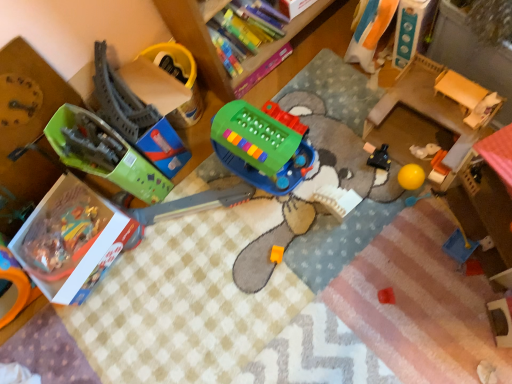
Consider the image. How much space does orange fabric doll at upper right, arranged as the third toy when viewed from the right, occupy horizontally?

6.05 inches.

Locate an element on the screen. green cardboard box at left is located at coordinates (27, 131).

Describe the element at coordinates (380, 158) in the screenshot. The image size is (512, 384). I see `black plastic toy at center-right, the second toy when ordered from right to left` at that location.

The image size is (512, 384). What are the coordinates of `gray plastic train tracks at left, marked as the 1th toy in a left-to-right arrangement` in the screenshot? It's located at (104, 153).

Considering the sizes of black plastic toy at center-right, the second toy when ordered from right to left, and orange fabric doll at upper right, arranged as the third toy when viewed from the right, in the image, is black plastic toy at center-right, the second toy when ordered from right to left, bigger or smaller than orange fabric doll at upper right, arranged as the third toy when viewed from the right,?

black plastic toy at center-right, the second toy when ordered from right to left, is smaller than orange fabric doll at upper right, arranged as the third toy when viewed from the right.

Considering their positions, is black plastic toy at center-right, which is the 5th toy in left-to-right order, located in front of or behind orange fabric doll at upper right, arranged as the third toy when viewed from the right?

Visually, black plastic toy at center-right, which is the 5th toy in left-to-right order, is located behind orange fabric doll at upper right, arranged as the third toy when viewed from the right.

From the picture: Is orange fabric doll at upper right, the fourth toy when ordered from left to right, located within black plastic toy at center-right, the second toy when ordered from right to left?

That's incorrect, orange fabric doll at upper right, the fourth toy when ordered from left to right, is not inside black plastic toy at center-right, the second toy when ordered from right to left.

Looking at this image, is gray plastic train tracks at left, placed as the sixth toy when sorted from right to left, beside wooden changing table at right?

gray plastic train tracks at left, placed as the sixth toy when sorted from right to left, and wooden changing table at right are clearly separated.

Is gray plastic train tracks at left, marked as the 1th toy in a left-to-right arrangement, to the right of wooden changing table at right from the viewer's perspective?

No.

Can you confirm if gray plastic train tracks at left, marked as the 1th toy in a left-to-right arrangement, is thinner than wooden changing table at right?

In fact, gray plastic train tracks at left, marked as the 1th toy in a left-to-right arrangement, might be wider than wooden changing table at right.

Is wooden changing table at right facing away from gray plastic train tracks at left, the 5th toy positioned from the right?

No, wooden changing table at right is not facing away from gray plastic train tracks at left, the 5th toy positioned from the right.

Which object is positioned more to the right, wooden changing table at right or gray plastic train tracks at left, the 2th toy in the left-to-right sequence?

Positioned to the right is wooden changing table at right.

Considering the positions of points (407, 95) and (154, 146), is point (407, 95) farther from camera compared to point (154, 146)?

No, it is not.

Is wooden changing table at right beside gray plastic train tracks at left, the 2th toy in the left-to-right sequence?

wooden changing table at right and gray plastic train tracks at left, the 2th toy in the left-to-right sequence, are clearly separated.

Can you confirm if matte cardboard box at upper center, which is the first box in top-to-bottom order, is shorter than hardcover book at upper center?

Yes, matte cardboard box at upper center, which is the first box in top-to-bottom order, is shorter than hardcover book at upper center.

Considering the positions of point (298, 5) and point (242, 14), is point (298, 5) closer or farther from the camera than point (242, 14)?

Point (298, 5) is farther from the camera than point (242, 14).

At what (x,y) coordinates should I click in order to perform the action: click on the 1st box below the hardcover book at upper center (from a real-world perspective). Please return your answer as a coordinate pair (x, y). Looking at the image, I should click on (294, 7).

Can you confirm if gray plastic train tracks at left, placed as the sixth toy when sorted from right to left, is bigger than green plastic toy at center, arranged as the 4th toy when viewed from the right?

Indeed, gray plastic train tracks at left, placed as the sixth toy when sorted from right to left, has a larger size compared to green plastic toy at center, arranged as the 4th toy when viewed from the right.

From the image's perspective, is gray plastic train tracks at left, marked as the 1th toy in a left-to-right arrangement, on green plastic toy at center, placed as the third toy when sorted from left to right?

No.

From a real-world perspective, is gray plastic train tracks at left, placed as the sixth toy when sorted from right to left, located higher than green plastic toy at center, placed as the third toy when sorted from left to right?

Yes.

The width and height of the screenshot is (512, 384). I want to click on toy that is the 2nd one when counting downward from the green plastic toy at center, placed as the third toy when sorted from left to right (from the image's perspective), so click(x=104, y=153).

Considering the sizes of blue plastic dustpan at lower right, which ranks as the 1th toy in right-to-left order, and hardcover book at upper center in the image, is blue plastic dustpan at lower right, which ranks as the 1th toy in right-to-left order, taller or shorter than hardcover book at upper center?

Clearly, blue plastic dustpan at lower right, which ranks as the 1th toy in right-to-left order, is shorter compared to hardcover book at upper center.

Which is correct: blue plastic dustpan at lower right, the 6th toy in the left-to-right sequence, is inside hardcover book at upper center, or outside of it?

blue plastic dustpan at lower right, the 6th toy in the left-to-right sequence, is not enclosed by hardcover book at upper center.

Are blue plastic dustpan at lower right, the 6th toy in the left-to-right sequence, and hardcover book at upper center making contact?

blue plastic dustpan at lower right, the 6th toy in the left-to-right sequence, is not next to hardcover book at upper center, and they're not touching.

From the image's perspective, relative to hardcover book at upper center, is blue plastic dustpan at lower right, which ranks as the 1th toy in right-to-left order, above or below?

From the image's perspective, blue plastic dustpan at lower right, which ranks as the 1th toy in right-to-left order, appears below hardcover book at upper center.

Is blue plastic dustpan at lower right, the 6th toy in the left-to-right sequence, directly adjacent to green cardboard box at left?

No.

Is point (462, 247) positioned after point (27, 148)?

No, (462, 247) is closer to viewer.

From the image's perspective, which object appears higher, blue plastic dustpan at lower right, the 6th toy in the left-to-right sequence, or green cardboard box at left?

green cardboard box at left is shown above in the image.

Which object is closer to the camera taking this photo, blue plastic dustpan at lower right, the 6th toy in the left-to-right sequence, or green cardboard box at left?

green cardboard box at left is in front.

Starting from the orange fabric doll at upper right, arranged as the third toy when viewed from the right, which toy is the 1st one to the right? Please provide its 2D coordinates.

[(380, 158)]

Where is `toy that is the 3rd object located below the wooden changing table at right (from the image's perspective)`? This screenshot has height=384, width=512. toy that is the 3rd object located below the wooden changing table at right (from the image's perspective) is located at coordinates point(104,153).

Considering their positions, is green plastic toy at center, placed as the third toy when sorted from left to right, positioned closer to orange fabric doll at upper right, arranged as the third toy when viewed from the right, than wooden changing table at right?

The object closer to orange fabric doll at upper right, arranged as the third toy when viewed from the right, is wooden changing table at right.

Based on their spatial positions, is white cardboard box at left, marked as the second box in a right-to-left arrangement, or black plastic toy at center-right, which is the 5th toy in left-to-right order, further from gray plastic train tracks at left, the 2th toy in the left-to-right sequence?

black plastic toy at center-right, which is the 5th toy in left-to-right order, is further to gray plastic train tracks at left, the 2th toy in the left-to-right sequence.

From the image, which object appears to be farther from wooden bookshelf at upper center, gray plastic train tracks at left, the 5th toy positioned from the right, or orange fabric doll at upper right, arranged as the third toy when viewed from the right?

orange fabric doll at upper right, arranged as the third toy when viewed from the right, is further to wooden bookshelf at upper center.

Looking at the image, which one is located further to matte cardboard box at upper center, which is counted as the second box, starting from the bottom, wooden changing table at right or green cardboard box at left?

green cardboard box at left.

Based on their spatial positions, is wooden changing table at right or green plastic toy at center, placed as the third toy when sorted from left to right, closer to hardcover book at upper center?

Among the two, green plastic toy at center, placed as the third toy when sorted from left to right, is located nearer to hardcover book at upper center.

Which object lies nearer to the anchor point orange fabric doll at upper right, the fourth toy when ordered from left to right, gray plastic train tracks at left, marked as the 1th toy in a left-to-right arrangement, or matte cardboard box at upper center, which is counted as the second box, starting from the bottom?

matte cardboard box at upper center, which is counted as the second box, starting from the bottom, lies closer to orange fabric doll at upper right, the fourth toy when ordered from left to right, than the other object.

From the image, which object appears to be farther from blue plastic dustpan at lower right, the 6th toy in the left-to-right sequence, wooden changing table at right or wooden bookshelf at upper center?

wooden bookshelf at upper center is further to blue plastic dustpan at lower right, the 6th toy in the left-to-right sequence.

When comparing their distances from hardcover book at upper center, does gray plastic train tracks at left, the 2th toy in the left-to-right sequence, or orange fabric doll at upper right, arranged as the third toy when viewed from the right, seem closer?

orange fabric doll at upper right, arranged as the third toy when viewed from the right, is positioned closer to the anchor hardcover book at upper center.

What are the coordinates of `book that lies between matte cardboard box at upper center, which is counted as the second box, starting from the bottom, and gray plastic train tracks at left, placed as the sixth toy when sorted from right to left, from top to bottom` in the screenshot? It's located at (248, 25).

Where is `book between gray plastic train tracks at left, the 2th toy in the left-to-right sequence, and blue plastic dustpan at lower right, which ranks as the 1th toy in right-to-left order, in the horizontal direction`? book between gray plastic train tracks at left, the 2th toy in the left-to-right sequence, and blue plastic dustpan at lower right, which ranks as the 1th toy in right-to-left order, in the horizontal direction is located at coordinates (248, 25).

The width and height of the screenshot is (512, 384). In order to click on box between white cardboard box at left, which is counted as the second box, starting from the top, and blue plastic dustpan at lower right, which ranks as the 1th toy in right-to-left order in this screenshot , I will do `click(294, 7)`.

You are a GUI agent. You are given a task and a screenshot of the screen. Output one action in this format:
    pyautogui.click(x=<x>, y=<y>)
    Task: Click on the bookcase located between green plastic toy at center, placed as the third toy when sorted from left to right, and wooden changing table at right in the left-right direction
    
    Given the screenshot: What is the action you would take?
    pyautogui.click(x=214, y=48)